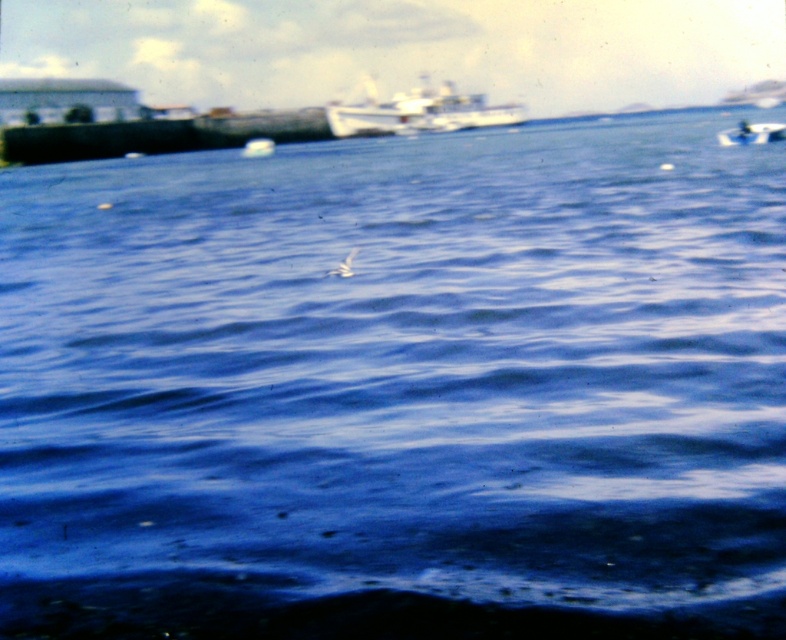
You are a photographer planning to capture both the white matte boat at upper center and the white plastic boat at upper right in a single frame. Given their sizes, which boat will appear wider in your photo?

The white matte boat at upper center will appear wider in the photo since its width surpasses that of the white plastic boat at upper right.

You are an observer standing on the pier. You see the white plastic boat at upper right and the white matte bird at center. Which object is wider?

The white plastic boat at upper right is wider than the white matte bird at center because its width surpasses the bird.